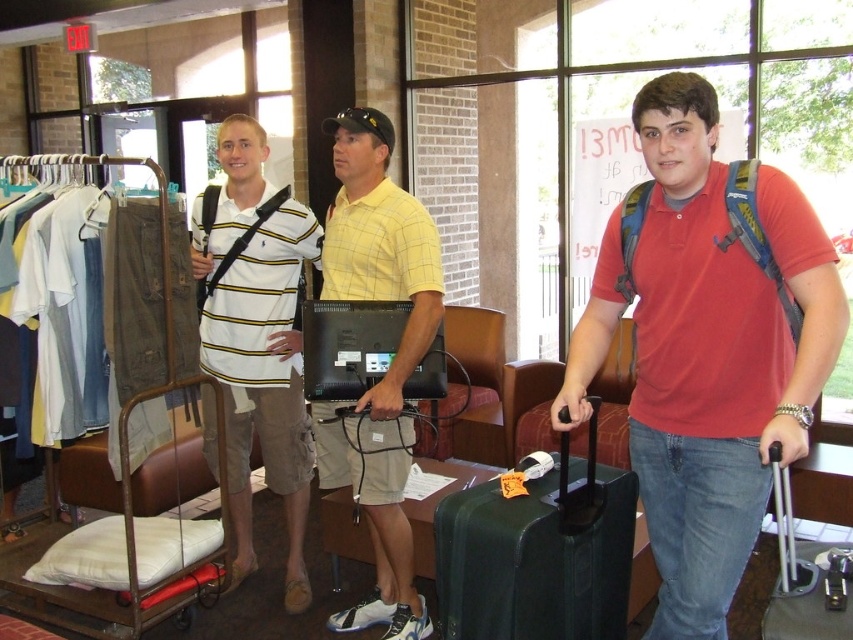
Question: Does yellow plaid shirt at center appear over black hard suitcase at lower right?

Choices:
 (A) yes
 (B) no

Answer: (A)

Question: Does matte red polo shirt at center appear on the right side of black hard suitcase at center?

Choices:
 (A) yes
 (B) no

Answer: (B)

Question: Among these objects, which one is nearest to the camera?

Choices:
 (A) black hard suitcase at center
 (B) white striped polo shirt at left
 (C) metallic silver trolley at left
 (D) yellow plaid shirt at center

Answer: (A)

Question: Which object is closer to the camera taking this photo?

Choices:
 (A) matte red polo shirt at center
 (B) white striped polo shirt at left
 (C) black hard suitcase at lower right

Answer: (A)

Question: Which point is farther from the camera taking this photo?

Choices:
 (A) (775, 611)
 (B) (538, 544)
 (C) (360, 241)
 (D) (238, 301)

Answer: (D)

Question: Does yellow plaid shirt at center appear under black hard suitcase at lower right?

Choices:
 (A) yes
 (B) no

Answer: (B)